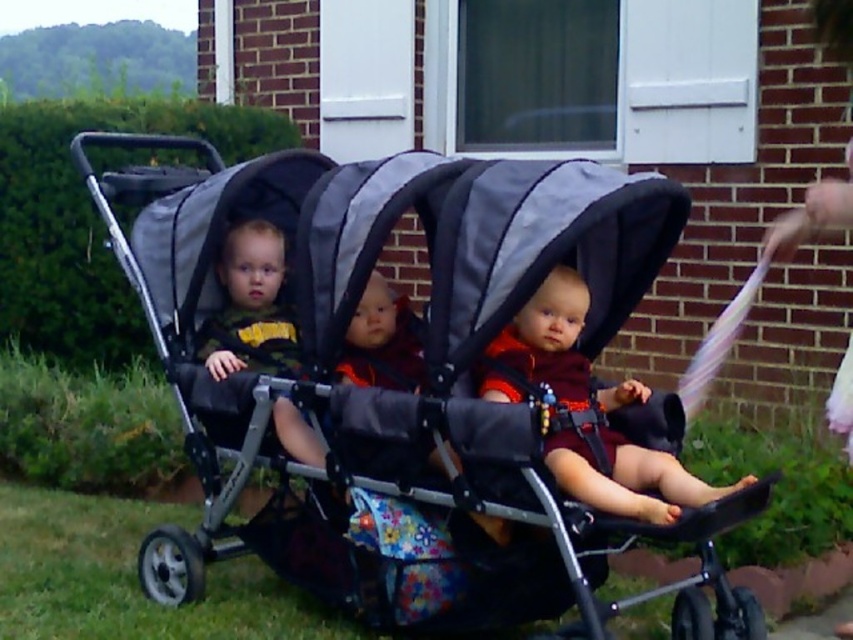
Is gray fabric stroller at center smaller than matte black stroller at center?

No, gray fabric stroller at center is not smaller than matte black stroller at center.

Can you confirm if gray fabric stroller at center is positioned below matte black stroller at center?

Actually, gray fabric stroller at center is above matte black stroller at center.

At what (x,y) coordinates should I click in order to perform the action: click on gray fabric stroller at center. Please return your answer as a coordinate pair (x, y). This screenshot has height=640, width=853. Looking at the image, I should click on (405, 380).